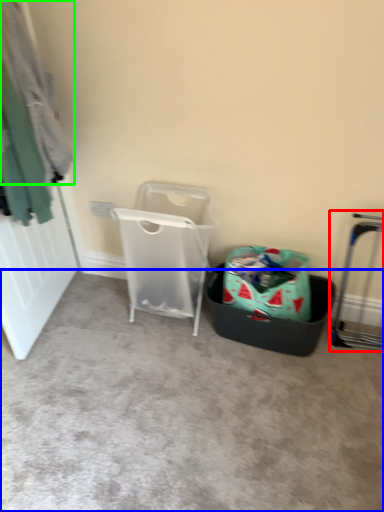
Question: Based on their relative distances, which object is nearer to trolley (highlighted by a red box)? Choose from concrete (highlighted by a blue box) and clothing (highlighted by a green box).

Choices:
 (A) concrete
 (B) clothing

Answer: (A)